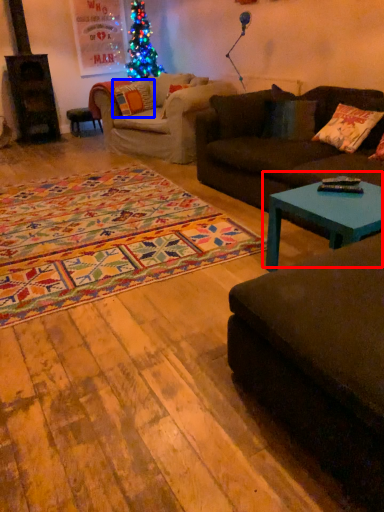
Question: Which object appears farthest to the camera in this image, coffee table (highlighted by a red box) or pillow (highlighted by a blue box)?

Choices:
 (A) coffee table
 (B) pillow

Answer: (B)